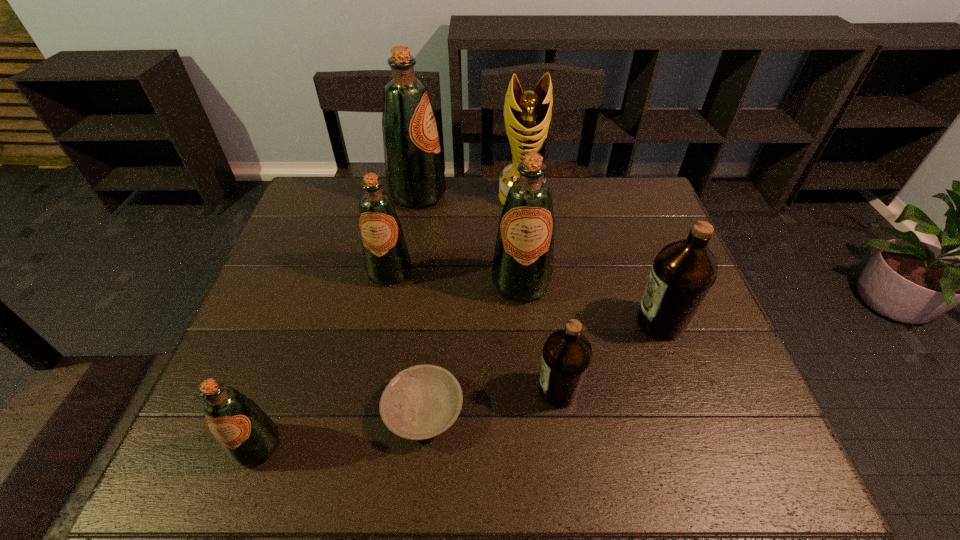
Identify the location of the farthest green olive oil. (415, 178).

Locate an element on the screen. the farthest olive oil is located at coordinates (415, 178).

Where is `award`? This screenshot has height=540, width=960. award is located at coordinates (527, 115).

Locate an element on the screen. The height and width of the screenshot is (540, 960). the third smallest green olive oil is located at coordinates (522, 269).

Locate an element on the screen. the rightmost green olive oil is located at coordinates (522, 269).

Locate an element on the screen. the third biggest green olive oil is located at coordinates (386, 258).

Image resolution: width=960 pixels, height=540 pixels. In order to click on the right brown olive oil in this screenshot , I will do `click(683, 272)`.

This screenshot has height=540, width=960. What are the coordinates of `the rightmost object` in the screenshot? It's located at (683, 272).

What are the coordinates of `the nearer brown olive oil` in the screenshot? It's located at (567, 355).

Locate an element on the screen. the smaller brown olive oil is located at coordinates (567, 355).